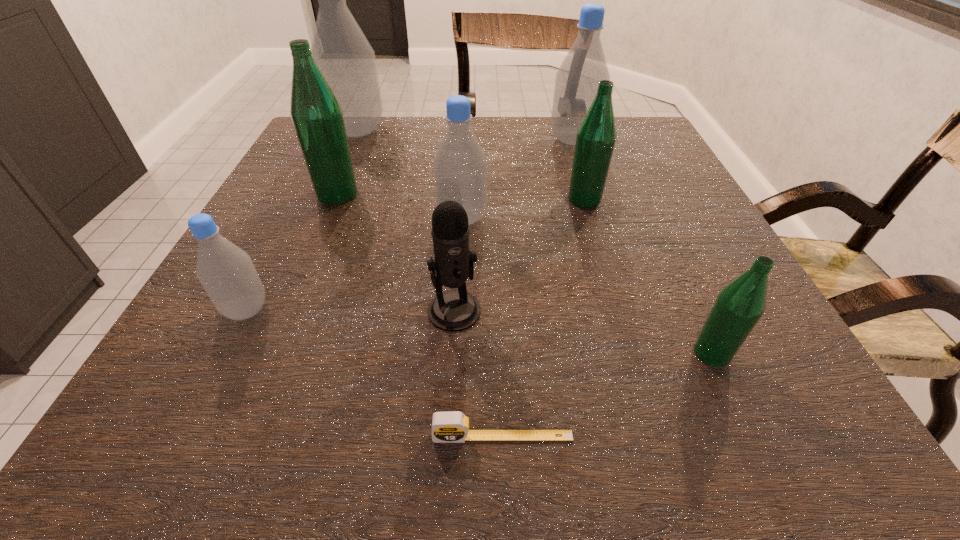
Find the location of a particular element. This screenshot has height=540, width=960. free space between the rightmost gray bottle and the microphone is located at coordinates (x=514, y=225).

The width and height of the screenshot is (960, 540). What are the coordinates of `free space between the smallest green bottle and the second smallest gray bottle` in the screenshot? It's located at (587, 286).

Identify the location of free space between the smallest green bottle and the second gray bottle from right to left. (587, 286).

Where is `free spot between the second biggest gray bottle and the nearest gray bottle`? The image size is (960, 540). free spot between the second biggest gray bottle and the nearest gray bottle is located at coordinates (410, 225).

Locate an element on the screen. free point between the nearest gray bottle and the rightmost object is located at coordinates pos(479,332).

Locate an element on the screen. This screenshot has height=540, width=960. free space that is in between the microphone and the tallest object is located at coordinates (406, 220).

Where is `vacant space that's between the nearest green bottle and the rightmost gray bottle`? This screenshot has height=540, width=960. vacant space that's between the nearest green bottle and the rightmost gray bottle is located at coordinates (642, 247).

Identify the location of vacant point located between the second gray bottle from right to left and the second green bottle from right to left. (523, 208).

I want to click on blank region between the rightmost gray bottle and the shortest object, so click(538, 288).

Find the location of `free space between the nearest gray bottle and the black microphone`. free space between the nearest gray bottle and the black microphone is located at coordinates (350, 310).